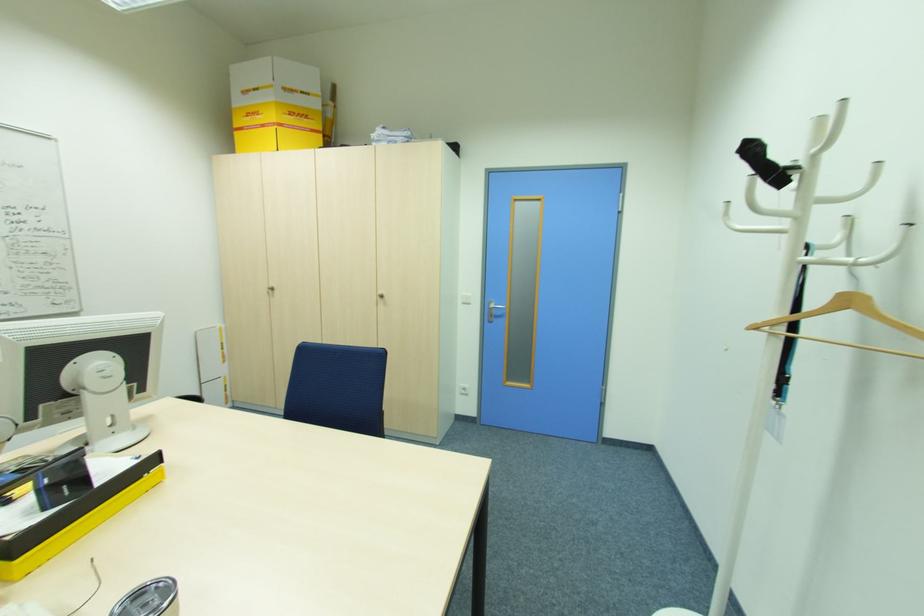
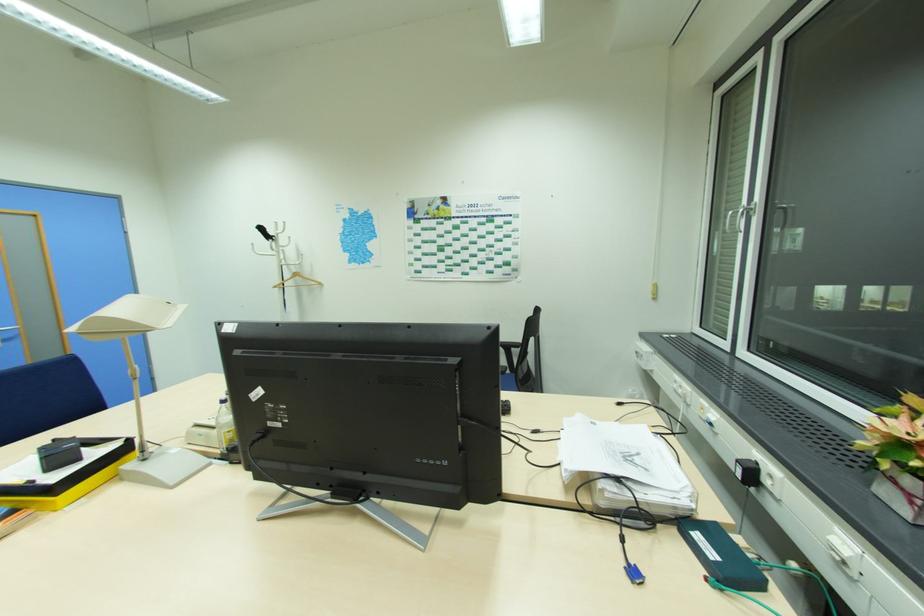
Find the pixel in the second image that matches (502,313) in the first image.

(11, 337)